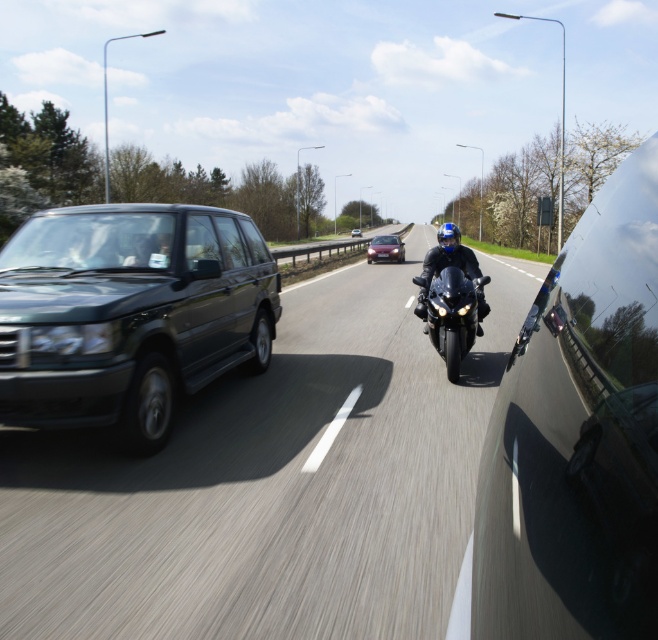
You are a pedestrian standing at the point marked by the coordinates (x=272, y=483). Looking at the scene, which vehicle is directly in front of you?

The point marked by the coordinates (x=272, y=483) indicates the black glossy suv at left, so the vehicle directly in front of you is the black glossy suv at left.

You are a pedestrian standing at the side of the road. You see a glossy black car at right and a metallic red sedan at center. Which vehicle is closer to you?

The glossy black car at right is closer to you because it is in front of the metallic red sedan at center.